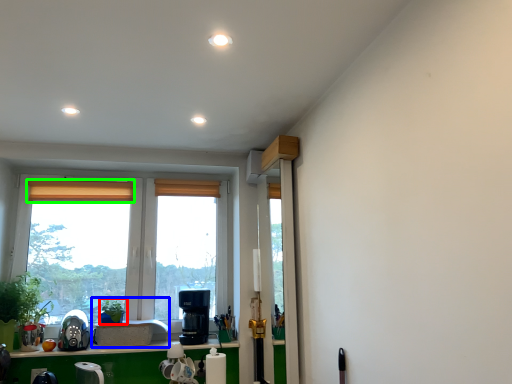
Question: Which object is the farthest from plant (highlighted by a red box)? Choose among these: sink (highlighted by a blue box) or curtain (highlighted by a green box).

Choices:
 (A) sink
 (B) curtain

Answer: (B)